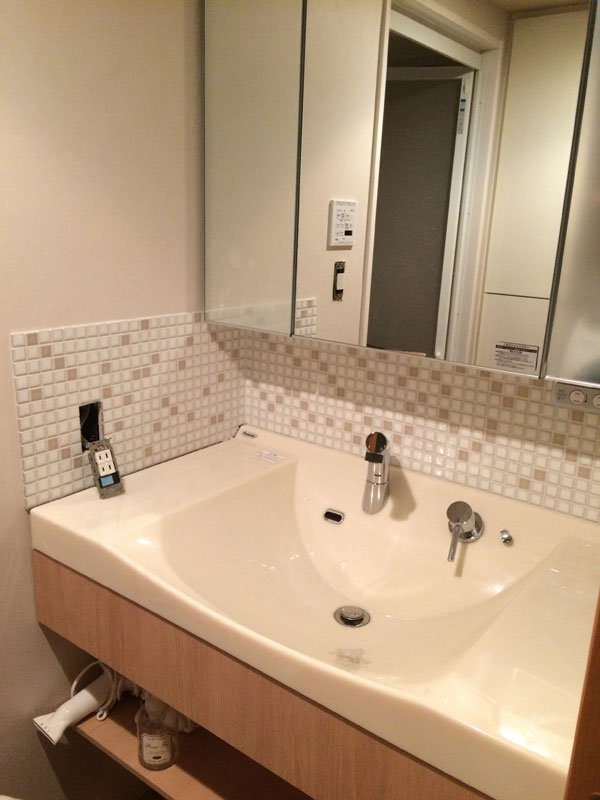
Locate an element on the screen. The height and width of the screenshot is (800, 600). socket is located at coordinates (96, 460).